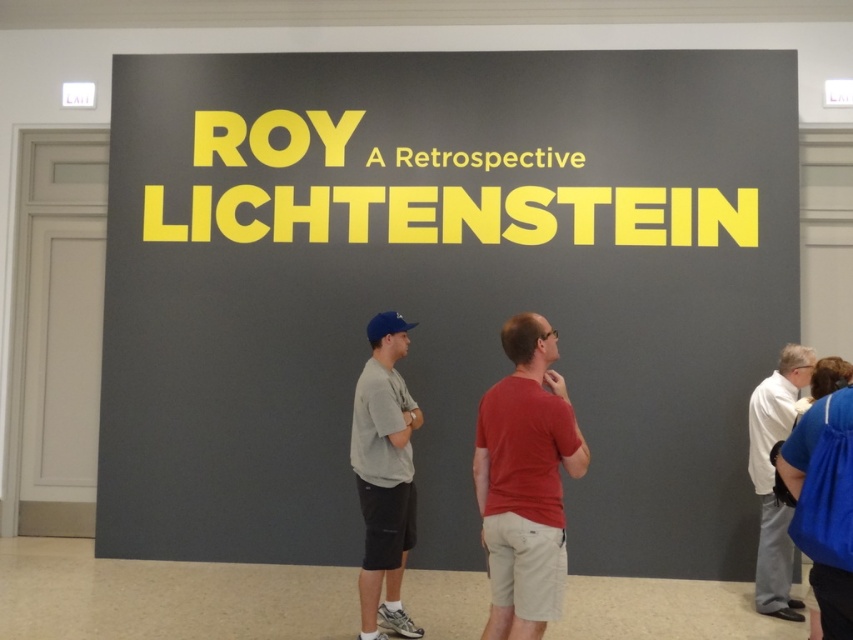
Does point (111, 518) come in front of point (796, 620)?

No, (111, 518) is behind (796, 620).

Who is more forward, (621, 476) or (758, 586)?

Positioned in front is point (758, 586).

Who is more forward, (659, 108) or (764, 417)?

Positioned in front is point (764, 417).

I want to click on matte yellow text at center, so click(440, 289).

The height and width of the screenshot is (640, 853). What do you see at coordinates (440, 289) in the screenshot? I see `matte yellow text at center` at bounding box center [440, 289].

Consider the image. Does matte yellow text at center appear on the left side of gray fabric shirt at center?

In fact, matte yellow text at center is to the right of gray fabric shirt at center.

Based on the photo, who is more distant from viewer, (274, 346) or (364, 472)?

Positioned behind is point (274, 346).

Find the location of a particular element. matte yellow text at center is located at coordinates (440, 289).

Is point (566, 417) closer to viewer compared to point (386, 349)?

Yes, it is.

Is point (550, 550) farther from viewer compared to point (387, 316)?

No, it is in front of (387, 316).

This screenshot has height=640, width=853. Identify the location of red cotton shirt at center. (524, 477).